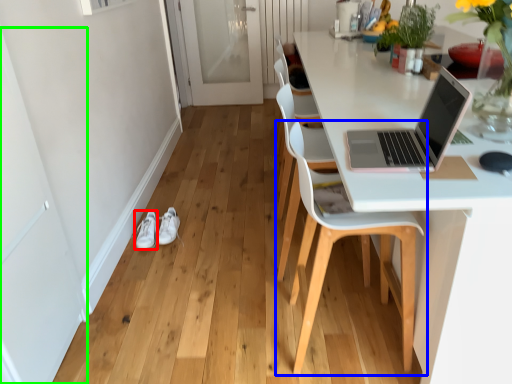
Question: Based on their relative distances, which object is nearer to footwear (highlighted by a red box)? Choose from chair (highlighted by a blue box) and screen door (highlighted by a green box).

Choices:
 (A) chair
 (B) screen door

Answer: (B)